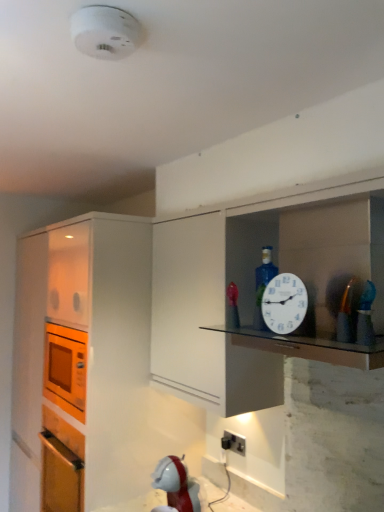
Measure the distance between point [275,323] and camera.

A distance of 4.04 feet exists between point [275,323] and camera.

What do you see at coordinates (309, 347) in the screenshot? I see `transparent glass shelf at upper center` at bounding box center [309, 347].

What do you see at coordinates (85, 352) in the screenshot? The image size is (384, 512). I see `orange matte microwave at left` at bounding box center [85, 352].

The image size is (384, 512). What do you see at coordinates (346, 314) in the screenshot?
I see `metallic gold toy at right` at bounding box center [346, 314].

Find the location of `white plastic clock at upper right`. white plastic clock at upper right is located at coordinates (284, 303).

Is white plastic smoke detector at upper center aimed at white plastic clock at upper right?

No, white plastic smoke detector at upper center is not aimed at white plastic clock at upper right.

Considering the sizes of white plastic smoke detector at upper center and white plastic clock at upper right in the image, is white plastic smoke detector at upper center taller or shorter than white plastic clock at upper right?

In the image, white plastic smoke detector at upper center appears to be shorter than white plastic clock at upper right.

Based on the photo, between white plastic smoke detector at upper center and white plastic clock at upper right, which one has larger size?

With larger size is white plastic smoke detector at upper center.

How far apart are white plastic clock at upper right and white plastic smoke detector at upper center?

The distance of white plastic clock at upper right from white plastic smoke detector at upper center is 30.10 inches.

From the image's perspective, which is above, white plastic clock at upper right or white plastic smoke detector at upper center?

white plastic smoke detector at upper center, from the image's perspective.

Would you say white plastic smoke detector at upper center is part of white plastic clock at upper right's contents?

Actually, white plastic smoke detector at upper center is outside white plastic clock at upper right.

Is white plastic clock at upper right at the left side of white plastic smoke detector at upper center?

Incorrect, white plastic clock at upper right is not on the left side of white plastic smoke detector at upper center.

Do you think metallic gold toy at right is within white plastic clock at upper right, or outside of it?

metallic gold toy at right is spatially situated outside white plastic clock at upper right.

Considering the sizes of objects metallic gold toy at right and white plastic clock at upper right in the image provided, who is wider, metallic gold toy at right or white plastic clock at upper right?

metallic gold toy at right is wider.

Are metallic gold toy at right and white plastic clock at upper right making contact?

No, metallic gold toy at right is not beside white plastic clock at upper right.

Is metallic gold toy at right facing away from black plastic electric outlet at lower center?

That's not correct — metallic gold toy at right is not looking away from black plastic electric outlet at lower center.

Between metallic gold toy at right and black plastic electric outlet at lower center, which one is positioned in front?

metallic gold toy at right is more forward.

Locate an element on the screen. The width and height of the screenshot is (384, 512). electric outlet behind the metallic gold toy at right is located at coordinates (233, 442).

How different are the orientations of metallic gold toy at right and black plastic electric outlet at lower center in degrees?

The angular difference between metallic gold toy at right and black plastic electric outlet at lower center is 14.5 degrees.

From a real-world perspective, is transparent glass shelf at upper center on white plastic clock at upper right?

Incorrect, from a real-world perspective, transparent glass shelf at upper center is lower than white plastic clock at upper right.

Is transparent glass shelf at upper center turned away from white plastic clock at upper right?

transparent glass shelf at upper center is not turned away from white plastic clock at upper right.

Considering the positions of points (226, 329) and (270, 327), is point (226, 329) closer to camera compared to point (270, 327)?

That is False.

What's the angular difference between transparent glass shelf at upper center and white plastic clock at upper right's facing directions?

transparent glass shelf at upper center and white plastic clock at upper right are facing 0.574 degrees away from each other.

Is metallic gold toy at right aimed at white plastic smoke detector at upper center?

No, metallic gold toy at right is not oriented towards white plastic smoke detector at upper center.

Between metallic gold toy at right and white plastic smoke detector at upper center, which one has smaller width?

With smaller width is metallic gold toy at right.

Considering the positions of objects metallic gold toy at right and white plastic smoke detector at upper center in the image provided, who is behind, metallic gold toy at right or white plastic smoke detector at upper center?

metallic gold toy at right is behind.

Is metallic gold toy at right not within white plastic smoke detector at upper center?

Yes, metallic gold toy at right is located beyond the bounds of white plastic smoke detector at upper center.

Between white plastic clock at upper right and black plastic electric outlet at lower center, which one is positioned in front?

Positioned in front is white plastic clock at upper right.

Is white plastic clock at upper right inside the boundaries of black plastic electric outlet at lower center, or outside?

white plastic clock at upper right lies outside black plastic electric outlet at lower center.

How many degrees apart are the facing directions of white plastic clock at upper right and black plastic electric outlet at lower center?

14.1 degrees.

This screenshot has width=384, height=512. In the image, there is a black plastic electric outlet at lower center. Identify the location of clock above it (from the image's perspective). (284, 303).

Locate an element on the screen. This screenshot has height=512, width=384. light fixture that appears above the white plastic clock at upper right (from the image's perspective) is located at coordinates [x=105, y=32].

Locate an element on the screen. This screenshot has height=512, width=384. clock that is behind the white plastic smoke detector at upper center is located at coordinates (284, 303).

Looking at the image, which one is located further to white plastic smoke detector at upper center, transparent glass shelf at upper center or white plastic clock at upper right?

Based on the image, transparent glass shelf at upper center appears to be further to white plastic smoke detector at upper center.

From the image, which object appears to be nearer to white plastic clock at upper right, metallic gold toy at right or black plastic electric outlet at lower center?

metallic gold toy at right is positioned closer to the anchor white plastic clock at upper right.

Consider the image. When comparing their distances from orange matte microwave at left, does white plastic smoke detector at upper center or white plastic clock at upper right seem further?

white plastic smoke detector at upper center is further to orange matte microwave at left.

When comparing their distances from metallic gold toy at right, does white plastic clock at upper right or black plastic electric outlet at lower center seem further?

Among the two, black plastic electric outlet at lower center is located further to metallic gold toy at right.

In the scene shown: Estimate the real-world distances between objects in this image. Which object is closer to black plastic electric outlet at lower center, white plastic smoke detector at upper center or transparent glass shelf at upper center?

transparent glass shelf at upper center is closer to black plastic electric outlet at lower center.

From the image, which object appears to be nearer to transparent glass shelf at upper center, white plastic smoke detector at upper center or metallic gold toy at right?

metallic gold toy at right.

Considering their positions, is white plastic smoke detector at upper center positioned further to orange matte microwave at left than black plastic electric outlet at lower center?

Among the two, white plastic smoke detector at upper center is located further to orange matte microwave at left.

From the image, which object appears to be nearer to black plastic electric outlet at lower center, white plastic clock at upper right or metallic gold toy at right?

The object closer to black plastic electric outlet at lower center is white plastic clock at upper right.

I want to click on clock between metallic gold toy at right and black plastic electric outlet at lower center along the z-axis, so click(284, 303).

Find the location of a particular element. counter top between white plastic smoke detector at upper center and black plastic electric outlet at lower center in the up-down direction is located at coordinates (309, 347).

This screenshot has height=512, width=384. Find the location of `cabinetry between transparent glass shelf at upper center and black plastic electric outlet at lower center along the z-axis`. cabinetry between transparent glass shelf at upper center and black plastic electric outlet at lower center along the z-axis is located at coordinates (85, 352).

I want to click on toy between white plastic smoke detector at upper center and black plastic electric outlet at lower center from top to bottom, so click(346, 314).